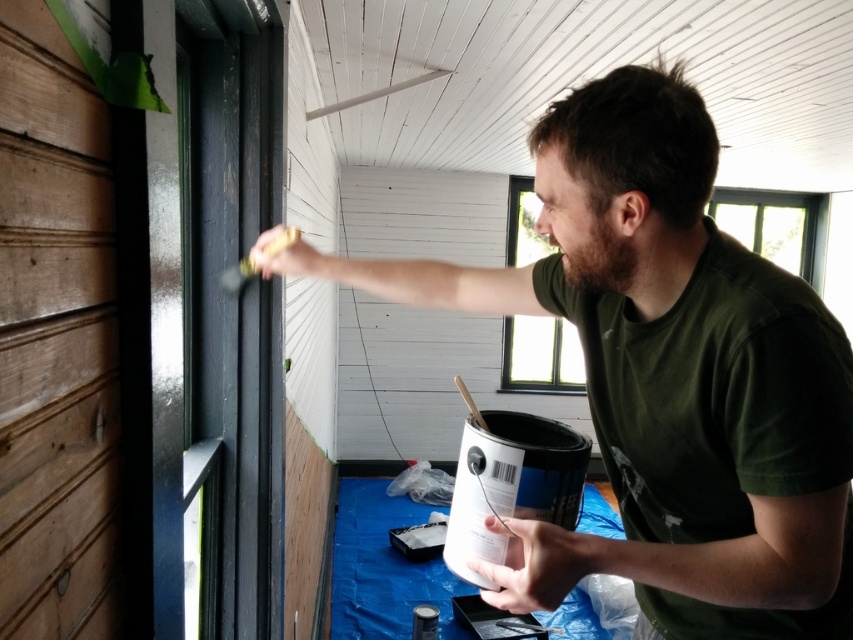
Question: Does matte green t-shirt at center have a greater width compared to brown fuzzy beard at center?

Choices:
 (A) no
 (B) yes

Answer: (B)

Question: Can you confirm if matte green t-shirt at center is positioned to the left of brown fuzzy beard at center?

Choices:
 (A) no
 (B) yes

Answer: (B)

Question: Can you confirm if matte green t-shirt at center is positioned below brown fuzzy beard at center?

Choices:
 (A) yes
 (B) no

Answer: (A)

Question: Which of the following is the closest to the observer?

Choices:
 (A) (624, 248)
 (B) (524, 572)

Answer: (B)